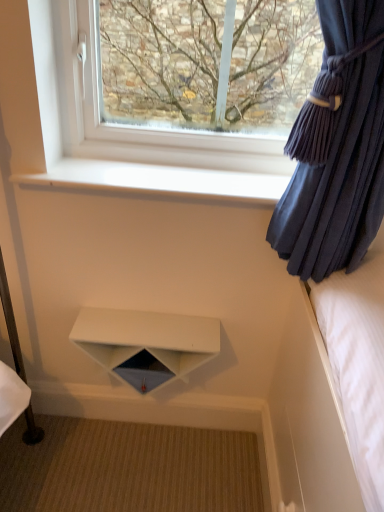
Question: Considering the relative sizes of velvet dark blue curtain at right and transparent glass window at upper center in the image provided, is velvet dark blue curtain at right taller than transparent glass window at upper center?

Choices:
 (A) yes
 (B) no

Answer: (A)

Question: Is velvet dark blue curtain at right smaller than transparent glass window at upper center?

Choices:
 (A) no
 (B) yes

Answer: (A)

Question: Is velvet dark blue curtain at right not close to transparent glass window at upper center?

Choices:
 (A) yes
 (B) no

Answer: (B)

Question: Does velvet dark blue curtain at right come in front of transparent glass window at upper center?

Choices:
 (A) no
 (B) yes

Answer: (B)

Question: Does velvet dark blue curtain at right have a lesser width compared to transparent glass window at upper center?

Choices:
 (A) yes
 (B) no

Answer: (B)

Question: From the image's perspective, relative to velvet dark blue curtain at right, is transparent glass window at upper center above or below?

Choices:
 (A) above
 (B) below

Answer: (A)

Question: Does point (x=291, y=124) appear closer or farther from the camera than point (x=324, y=113)?

Choices:
 (A) farther
 (B) closer

Answer: (A)

Question: From a real-world perspective, is transparent glass window at upper center positioned above or below velvet dark blue curtain at right?

Choices:
 (A) below
 (B) above

Answer: (B)

Question: Looking at their shapes, would you say transparent glass window at upper center is wider or thinner than velvet dark blue curtain at right?

Choices:
 (A) wide
 (B) thin

Answer: (B)

Question: Looking at the image, does white smooth window sill at upper center seem bigger or smaller compared to transparent glass window at upper center?

Choices:
 (A) small
 (B) big

Answer: (A)

Question: Considering the positions of point (200, 173) and point (129, 87), is point (200, 173) closer or farther from the camera than point (129, 87)?

Choices:
 (A) farther
 (B) closer

Answer: (B)

Question: From the image's perspective, is white smooth window sill at upper center located above or below transparent glass window at upper center?

Choices:
 (A) below
 (B) above

Answer: (A)

Question: Considering the positions of white smooth window sill at upper center and transparent glass window at upper center in the image, is white smooth window sill at upper center wider or thinner than transparent glass window at upper center?

Choices:
 (A) thin
 (B) wide

Answer: (B)

Question: Based on their sizes in the image, would you say white matte shelf at center is bigger or smaller than velvet dark blue curtain at right?

Choices:
 (A) small
 (B) big

Answer: (A)

Question: Looking at their shapes, would you say white matte shelf at center is wider or thinner than velvet dark blue curtain at right?

Choices:
 (A) wide
 (B) thin

Answer: (B)